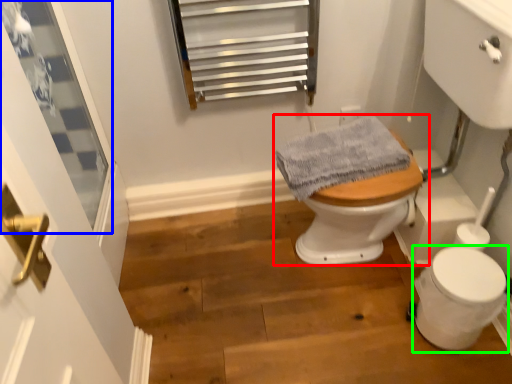
Question: Which object is positioned farthest from toilet (highlighted by a red box)? Select from window (highlighted by a blue box) and toilet bowl (highlighted by a green box).

Choices:
 (A) window
 (B) toilet bowl

Answer: (A)